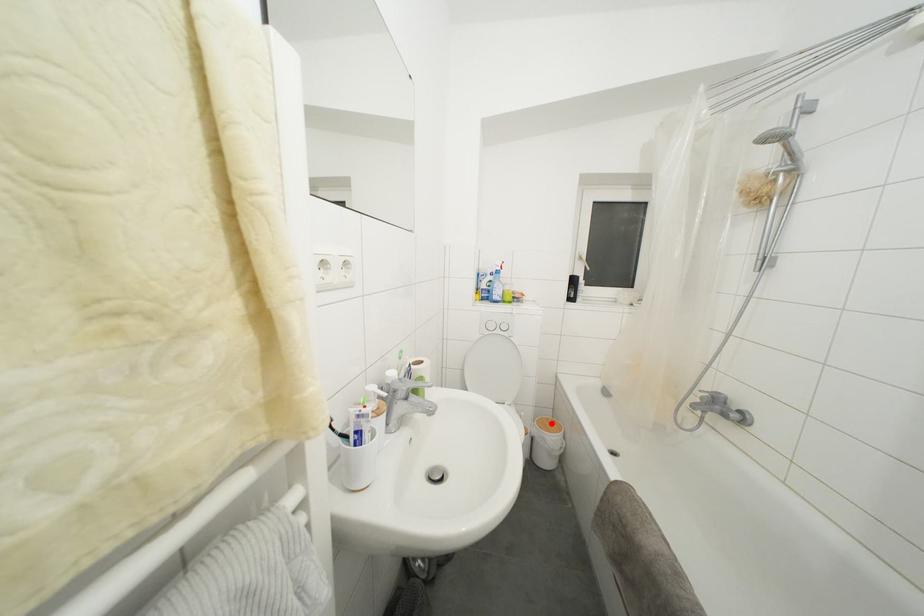
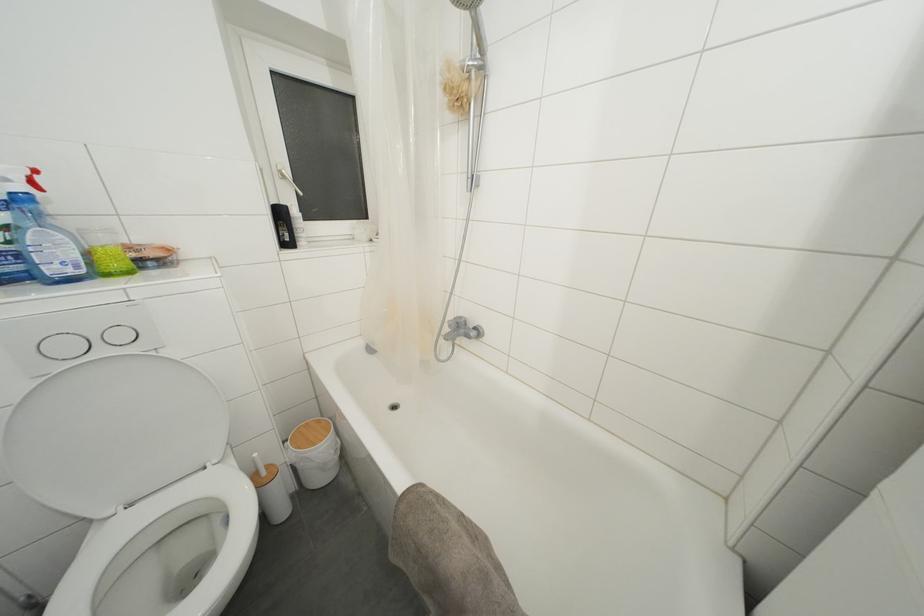
Locate, in the second image, the point that corresponds to the highlighted location in the first image.

(310, 429)